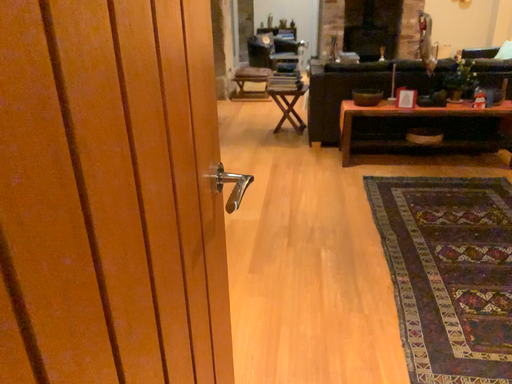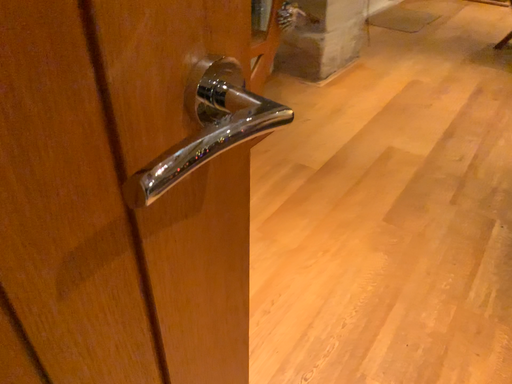
Question: Which way did the camera rotate in the video?

Choices:
 (A) rotated upward
 (B) rotated downward

Answer: (B)